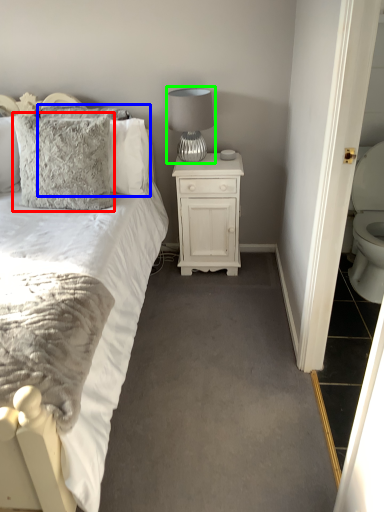
Question: Which object is the closest to the pillow (highlighted by a red box)? Choose among these: pillow (highlighted by a blue box) or table lamp (highlighted by a green box).

Choices:
 (A) pillow
 (B) table lamp

Answer: (A)